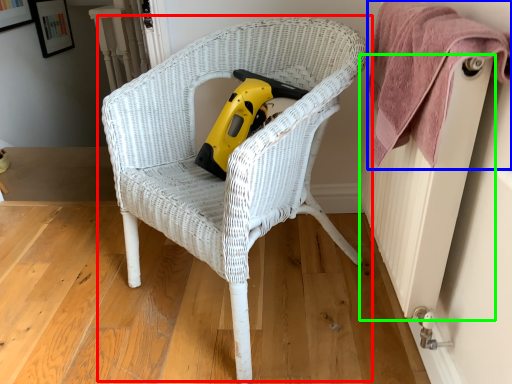
Question: Which object is the farthest from chair (highlighted by a red box)? Choose among these: towel (highlighted by a blue box) or radiator (highlighted by a green box).

Choices:
 (A) towel
 (B) radiator

Answer: (B)